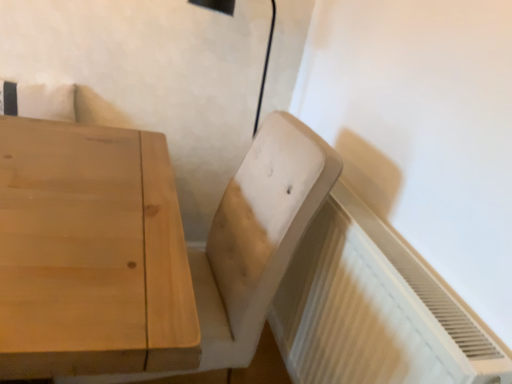
Question: Can light brown wood swivel chair at center be found inside white textured radiator at lower right?

Choices:
 (A) yes
 (B) no

Answer: (B)

Question: Is white textured radiator at lower right positioned before light brown wood swivel chair at center?

Choices:
 (A) yes
 (B) no

Answer: (A)

Question: Is white textured radiator at lower right aimed at light brown wood swivel chair at center?

Choices:
 (A) yes
 (B) no

Answer: (A)

Question: From a real-world perspective, is white textured radiator at lower right on top of light brown wood swivel chair at center?

Choices:
 (A) yes
 (B) no

Answer: (B)

Question: Does white textured radiator at lower right have a greater width compared to light brown wood swivel chair at center?

Choices:
 (A) no
 (B) yes

Answer: (A)

Question: Does white textured radiator at lower right have a larger size compared to light brown wood swivel chair at center?

Choices:
 (A) yes
 (B) no

Answer: (B)

Question: Can you confirm if light brown wood swivel chair at center is positioned to the left of white textured radiator at lower right?

Choices:
 (A) no
 (B) yes

Answer: (B)

Question: Is light brown wood swivel chair at center aimed at white textured radiator at lower right?

Choices:
 (A) no
 (B) yes

Answer: (A)

Question: Is light brown wood swivel chair at center closer to camera compared to white textured radiator at lower right?

Choices:
 (A) no
 (B) yes

Answer: (A)

Question: Can you confirm if light brown wood swivel chair at center is smaller than white textured radiator at lower right?

Choices:
 (A) no
 (B) yes

Answer: (A)

Question: From the image's perspective, is light brown wood swivel chair at center above white textured radiator at lower right?

Choices:
 (A) no
 (B) yes

Answer: (B)

Question: Is there a large distance between light brown wood swivel chair at center and white textured radiator at lower right?

Choices:
 (A) no
 (B) yes

Answer: (A)

Question: Considering the positions of light brown wood swivel chair at center and white textured radiator at lower right in the image, is light brown wood swivel chair at center taller or shorter than white textured radiator at lower right?

Choices:
 (A) short
 (B) tall

Answer: (B)